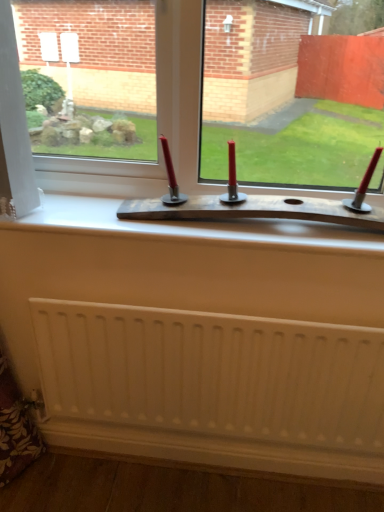
What do you see at coordinates (213, 373) in the screenshot? I see `white matte radiator at lower center` at bounding box center [213, 373].

Image resolution: width=384 pixels, height=512 pixels. I want to click on white matte radiator at lower center, so pos(213,373).

What do you see at coordinates (180, 87) in the screenshot?
I see `wooden board at center` at bounding box center [180, 87].

The width and height of the screenshot is (384, 512). What are the coordinates of `wooden board at center` in the screenshot? It's located at (180, 87).

You are a GUI agent. You are given a task and a screenshot of the screen. Output one action in this format:
    pyautogui.click(x=<x>, y=<y>)
    Task: Click on the white matte radiator at lower center
    
    Given the screenshot: What is the action you would take?
    pyautogui.click(x=213, y=373)

Which is more to the right, white matte radiator at lower center or wooden board at center?

From the viewer's perspective, white matte radiator at lower center appears more on the right side.

Is white matte radiator at lower center closer to the viewer compared to wooden board at center?

No, the depth of white matte radiator at lower center is greater than that of wooden board at center.

Considering the positions of point (174, 352) and point (373, 105), is point (174, 352) closer or farther from the camera than point (373, 105)?

Clearly, point (174, 352) is more distant from the camera than point (373, 105).

From the image's perspective, does white matte radiator at lower center appear higher than wooden board at center?

Actually, white matte radiator at lower center appears below wooden board at center in the image.

From a real-world perspective, who is located higher, white matte radiator at lower center or wooden board at center?

In real-world perspective, wooden board at center is above.

Does white matte radiator at lower center have a lesser width compared to wooden board at center?

Indeed, white matte radiator at lower center has a lesser width compared to wooden board at center.

From their relative heights in the image, would you say white matte radiator at lower center is taller or shorter than wooden board at center?

white matte radiator at lower center is shorter than wooden board at center.

Considering the sizes of objects white matte radiator at lower center and wooden board at center in the image provided, who is smaller, white matte radiator at lower center or wooden board at center?

Smaller between the two is white matte radiator at lower center.

Is wooden board at center a part of white matte radiator at lower center?

Actually, wooden board at center is outside white matte radiator at lower center.

Is there a large distance between white matte radiator at lower center and wooden board at center?

No, white matte radiator at lower center is not far away from wooden board at center.

Could you tell me if white matte radiator at lower center is turned towards wooden board at center?

No, white matte radiator at lower center is not oriented towards wooden board at center.

Find the location of `radiator behind the wooden board at center`. radiator behind the wooden board at center is located at coordinates (213, 373).

Can you confirm if wooden board at center is positioned to the right of white matte radiator at lower center?

No, wooden board at center is not to the right of white matte radiator at lower center.

Does wooden board at center come in front of white matte radiator at lower center?

Yes, it is in front of white matte radiator at lower center.

Does point (191, 44) come closer to viewer compared to point (126, 332)?

That is True.

From the image's perspective, would you say wooden board at center is positioned over white matte radiator at lower center?

Yes, from the image's perspective, wooden board at center is above white matte radiator at lower center.

From a real-world perspective, is wooden board at center located higher than white matte radiator at lower center?

Yes, from a real-world perspective, wooden board at center is on top of white matte radiator at lower center.

In the scene shown: Which object is wider, wooden board at center or white matte radiator at lower center?

Wider between the two is wooden board at center.

Does wooden board at center have a lesser height compared to white matte radiator at lower center?

No, wooden board at center is not shorter than white matte radiator at lower center.

Does wooden board at center have a larger size compared to white matte radiator at lower center?

Indeed, wooden board at center has a larger size compared to white matte radiator at lower center.

Is wooden board at center not inside white matte radiator at lower center?

Indeed, wooden board at center is completely outside white matte radiator at lower center.

Is the surface of wooden board at center in direct contact with white matte radiator at lower center?

wooden board at center is not next to white matte radiator at lower center, and they're not touching.

Is wooden board at center oriented away from white matte radiator at lower center?

No, wooden board at center is not facing away from white matte radiator at lower center.

Based on the photo, how different are the orientations of wooden board at center and white matte radiator at lower center in degrees?

The angular difference between wooden board at center and white matte radiator at lower center is 0.235 degrees.

Measure the distance between wooden board at center and white matte radiator at lower center.

18.77 inches.

This screenshot has height=512, width=384. There is a white matte radiator at lower center. In order to click on window above it (from a real-world perspective) in this screenshot , I will do `click(180, 87)`.

The height and width of the screenshot is (512, 384). In order to click on window on the left of white matte radiator at lower center in this screenshot , I will do `click(180, 87)`.

Identify the location of window located above the white matte radiator at lower center (from the image's perspective). The height and width of the screenshot is (512, 384). (180, 87).